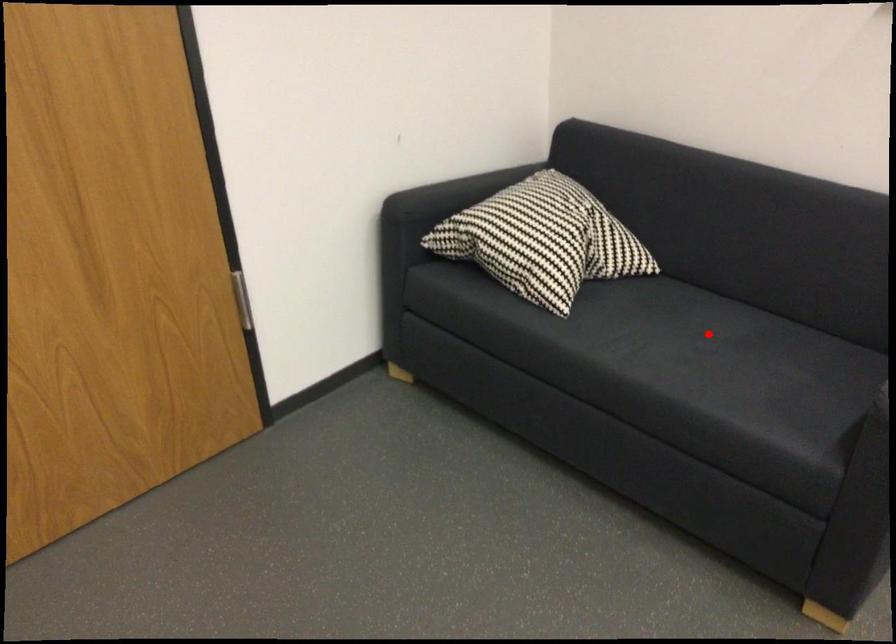
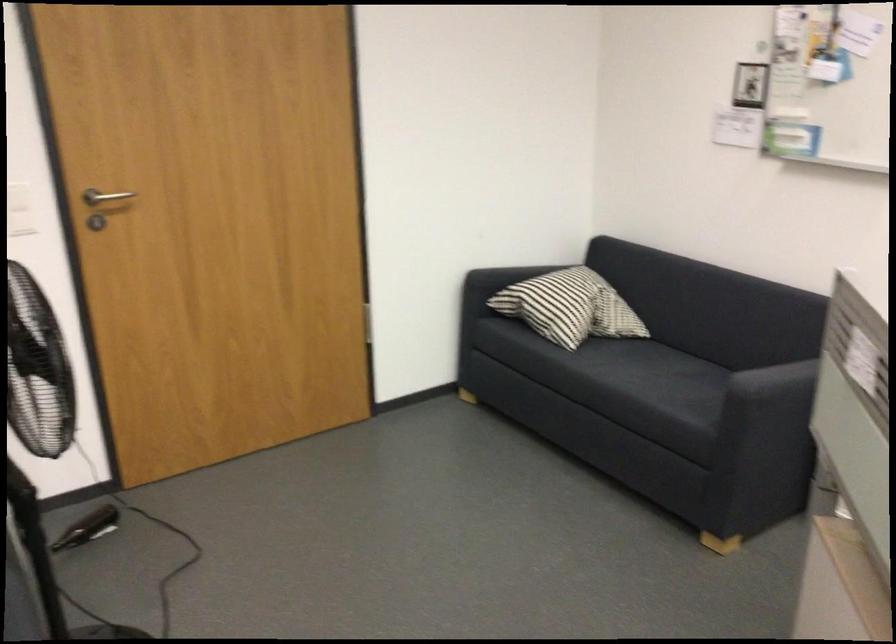
Question: A red point is marked in image1. In image2, is the corresponding 3D point closer to the camera or farther? Reply with the corresponding letter.

Choices:
 (A) The corresponding 3D point is closer.
 (B) The corresponding 3D point is farther.

Answer: (B)